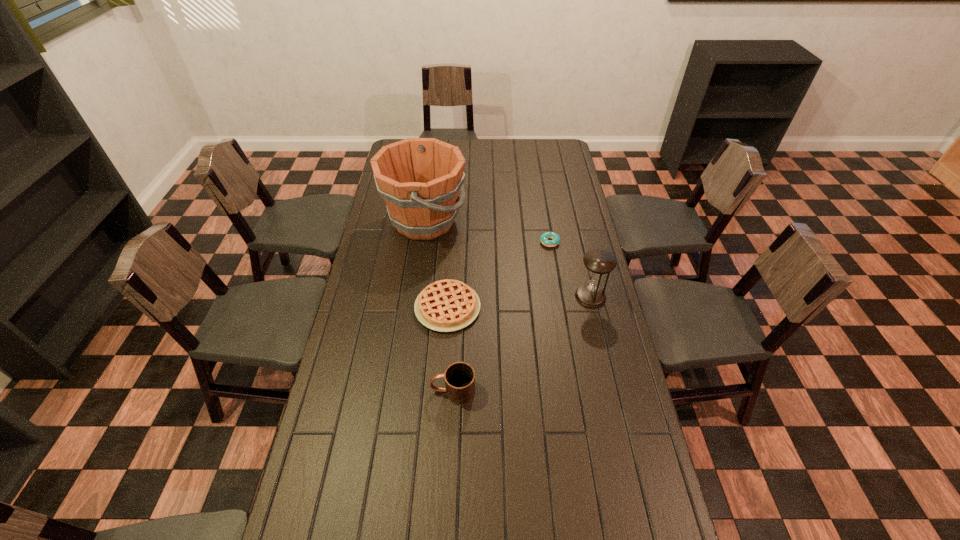
Locate an element on the screen. The image size is (960, 540). the tallest object is located at coordinates (420, 179).

Locate an element on the screen. The height and width of the screenshot is (540, 960). the rightmost object is located at coordinates tap(598, 262).

Where is `the second tallest object`? The width and height of the screenshot is (960, 540). the second tallest object is located at coordinates (598, 262).

At what (x,y) coordinates should I click in order to perform the action: click on mug. Please return your answer as a coordinate pair (x, y). Looking at the image, I should click on (459, 377).

The height and width of the screenshot is (540, 960). In order to click on the nearest object in this screenshot , I will do `click(459, 377)`.

At what (x,y) coordinates should I click in order to perform the action: click on pie. Please return your answer as a coordinate pair (x, y). This screenshot has width=960, height=540. Looking at the image, I should click on (448, 305).

The image size is (960, 540). I want to click on doughnut, so pyautogui.click(x=545, y=236).

You are a GUI agent. You are given a task and a screenshot of the screen. Output one action in this format:
    pyautogui.click(x=<x>, y=<y>)
    Task: Click on the fourth object from left to right
    
    Given the screenshot: What is the action you would take?
    pyautogui.click(x=545, y=236)

Where is `vacant region located on the handle side of the tallest object`? vacant region located on the handle side of the tallest object is located at coordinates (516, 221).

Where is `vacant space located on the left of the hourglass`? vacant space located on the left of the hourglass is located at coordinates (544, 296).